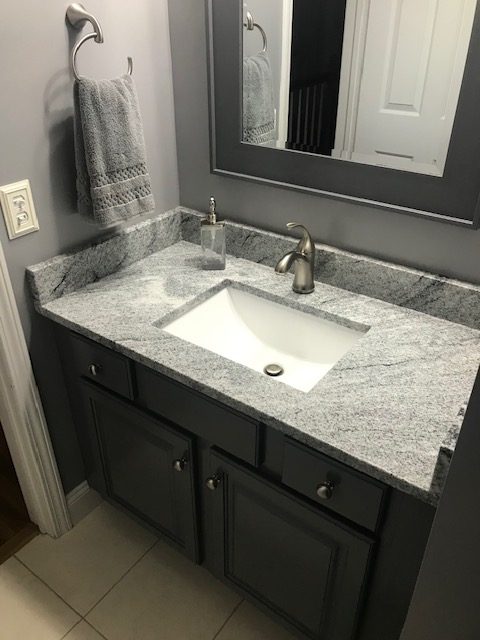
Find the location of a particular element. This screenshot has width=480, height=640. towel is located at coordinates (92, 144).